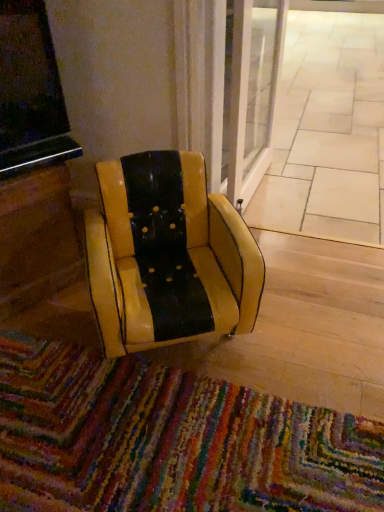
Where is `vacant area on top of multicolored woven mat at lower center (from a real-world perspective)`? The height and width of the screenshot is (512, 384). vacant area on top of multicolored woven mat at lower center (from a real-world perspective) is located at coordinates (149, 430).